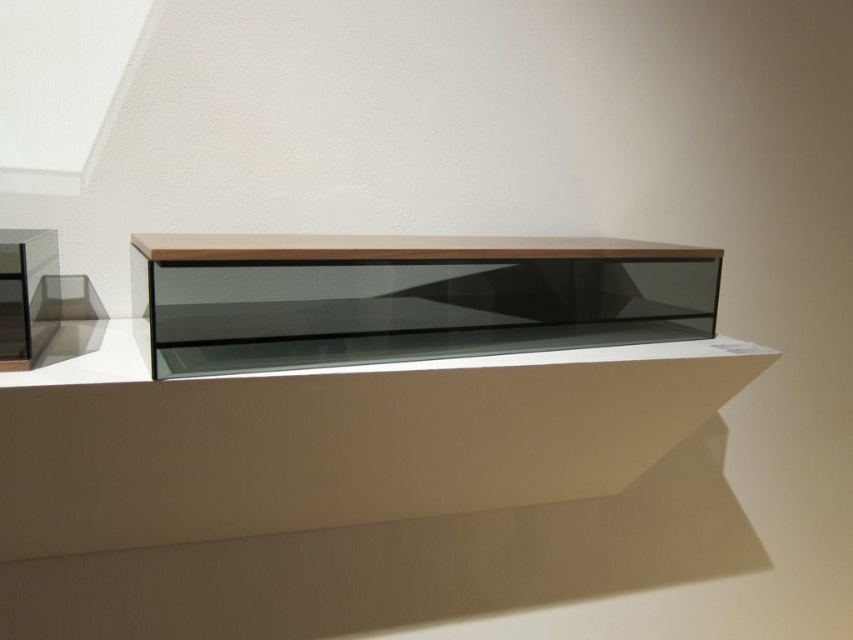
Can you confirm if matte wood shelf at center is positioned above transparent glass shelf at left?

Correct, matte wood shelf at center is located above transparent glass shelf at left.

Between point (485, 326) and point (28, 237), which one is positioned in front?

Positioned in front is point (28, 237).

This screenshot has width=853, height=640. I want to click on matte wood shelf at center, so click(409, 296).

Does white matte ledge at center have a larger size compared to transparent glass shelf at left?

Yes.

In the scene shown: Does white matte ledge at center have a lesser width compared to transparent glass shelf at left?

No.

Between point (405, 416) and point (1, 246), which one is positioned behind?

Positioned behind is point (405, 416).

This screenshot has height=640, width=853. Find the location of `white matte ledge at center`. white matte ledge at center is located at coordinates (335, 440).

Between point (352, 417) and point (630, 289), which one is positioned in front?

Point (352, 417)

Consider the image. Measure the distance between point (461, 420) and camera.

Point (461, 420) is 35.48 inches away from camera.

Between point (729, 362) and point (461, 284), which one is positioned behind?

The point (461, 284) is behind.

The height and width of the screenshot is (640, 853). Identify the location of white matte ledge at center. (335, 440).